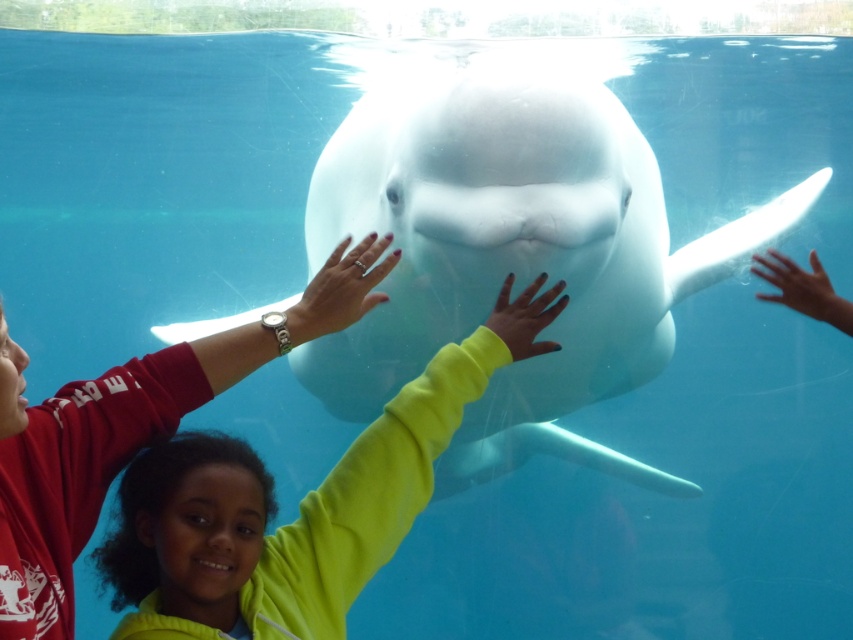
You are standing in front of an aquarium tank and see the white smooth whale at center. If you want to touch the whale, where should you position your hands relative to the tank?

The white smooth whale at center is located at point (514, 252), so you should position your hands at that coordinate to reach it.

Based on the scene description, where is the white smooth whale located in relation to the two people reaching out? Please provide coordinates in the format of a point like point (x=514, y=252).

The white smooth whale at center is located at point (x=514, y=252), which marks its position in the image.

You are a visitor at the aquarium standing 5 feet away from the glass barrier. The white smooth whale at center is 6.67 feet away from the camera. Can you estimate if you can touch the whale through the glass?

The white smooth whale at center is 6.67 feet away from the camera. Since you are standing 5 feet away from the glass barrier, the total distance between you and the whale would be 5 feet plus the distance from the glass to the whale. However, the given information only specifies the whale is 6.67 feet from the camera, not from the glass. Without knowing the exact distance from the glass to the whale, it is impossible to accurately determine if you can touch it.